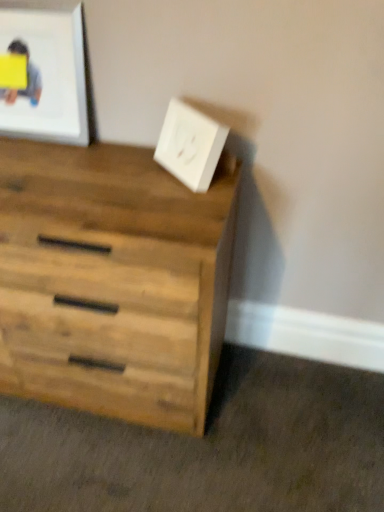
Question: Would you consider yellow paper at upper left to be distant from natural wood chest of drawers at lower left?

Choices:
 (A) no
 (B) yes

Answer: (A)

Question: From a real-world perspective, is yellow paper at upper left beneath natural wood chest of drawers at lower left?

Choices:
 (A) yes
 (B) no

Answer: (B)

Question: Could you tell me if yellow paper at upper left is turned towards natural wood chest of drawers at lower left?

Choices:
 (A) no
 (B) yes

Answer: (A)

Question: Is yellow paper at upper left thinner than natural wood chest of drawers at lower left?

Choices:
 (A) yes
 (B) no

Answer: (A)

Question: From a real-world perspective, is yellow paper at upper left located higher than natural wood chest of drawers at lower left?

Choices:
 (A) no
 (B) yes

Answer: (B)

Question: From a real-world perspective, is natural wood chest of drawers at lower left positioned above or below white matte picture frame at upper left?

Choices:
 (A) below
 (B) above

Answer: (A)

Question: In the image, is natural wood chest of drawers at lower left positioned in front of or behind white matte picture frame at upper left?

Choices:
 (A) front
 (B) behind

Answer: (A)

Question: Would you say natural wood chest of drawers at lower left is to the left or to the right of white matte picture frame at upper left in the picture?

Choices:
 (A) right
 (B) left

Answer: (A)

Question: Is natural wood chest of drawers at lower left taller or shorter than white matte picture frame at upper left?

Choices:
 (A) short
 (B) tall

Answer: (B)

Question: Considering the positions of natural wood chest of drawers at lower left and yellow paper at upper left in the image, is natural wood chest of drawers at lower left wider or thinner than yellow paper at upper left?

Choices:
 (A) thin
 (B) wide

Answer: (B)

Question: Considering the positions of natural wood chest of drawers at lower left and yellow paper at upper left in the image, is natural wood chest of drawers at lower left bigger or smaller than yellow paper at upper left?

Choices:
 (A) small
 (B) big

Answer: (B)

Question: Is point 16,309 closer or farther from the camera than point 11,101?

Choices:
 (A) farther
 (B) closer

Answer: (B)

Question: Visually, is natural wood chest of drawers at lower left positioned to the left or to the right of yellow paper at upper left?

Choices:
 (A) right
 (B) left

Answer: (A)

Question: From the image's perspective, relative to white matte picture frame at upper left, is yellow paper at upper left above or below?

Choices:
 (A) below
 (B) above

Answer: (B)

Question: Relative to white matte picture frame at upper left, is yellow paper at upper left in front or behind?

Choices:
 (A) behind
 (B) front

Answer: (A)